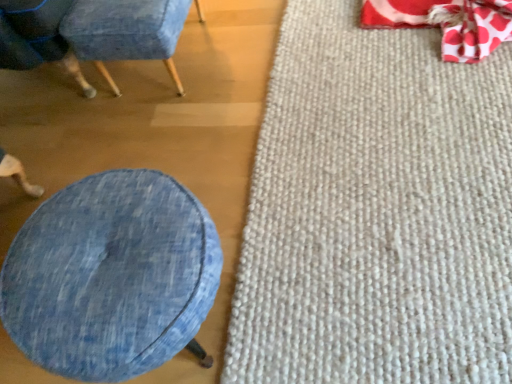
Question: Would you say denim fabric chair at upper left, which is the second chair from left to right, is outside red polka dot fabric bean bag chair at upper right?

Choices:
 (A) no
 (B) yes

Answer: (B)

Question: Considering the relative sizes of denim fabric chair at upper left, the first chair in the right-to-left sequence, and red polka dot fabric bean bag chair at upper right in the image provided, is denim fabric chair at upper left, the first chair in the right-to-left sequence, bigger than red polka dot fabric bean bag chair at upper right?

Choices:
 (A) no
 (B) yes

Answer: (B)

Question: From the image's perspective, does denim fabric chair at upper left, which is the second chair from left to right, appear lower than red polka dot fabric bean bag chair at upper right?

Choices:
 (A) yes
 (B) no

Answer: (B)

Question: Considering the relative sizes of denim fabric chair at upper left, the first chair in the right-to-left sequence, and red polka dot fabric bean bag chair at upper right in the image provided, is denim fabric chair at upper left, the first chair in the right-to-left sequence, shorter than red polka dot fabric bean bag chair at upper right?

Choices:
 (A) yes
 (B) no

Answer: (B)

Question: Could you tell me if denim fabric chair at upper left, the first chair in the right-to-left sequence, is turned towards red polka dot fabric bean bag chair at upper right?

Choices:
 (A) yes
 (B) no

Answer: (A)

Question: Considering the relative sizes of denim fabric chair at upper left, which is the second chair from left to right, and red polka dot fabric bean bag chair at upper right in the image provided, is denim fabric chair at upper left, which is the second chair from left to right, wider than red polka dot fabric bean bag chair at upper right?

Choices:
 (A) yes
 (B) no

Answer: (A)

Question: Is denim fabric at left, which is counted as the 1th chair, starting from the left, smaller than denim fabric ottoman at lower left?

Choices:
 (A) no
 (B) yes

Answer: (A)

Question: From a real-world perspective, is denim fabric at left, which is counted as the 1th chair, starting from the left, positioned over denim fabric ottoman at lower left based on gravity?

Choices:
 (A) yes
 (B) no

Answer: (A)

Question: Does denim fabric at left, which is counted as the 1th chair, starting from the left, have a lesser width compared to denim fabric ottoman at lower left?

Choices:
 (A) yes
 (B) no

Answer: (B)

Question: Considering the relative positions of denim fabric at left, which appears as the 2th chair when viewed from the right, and denim fabric ottoman at lower left in the image provided, is denim fabric at left, which appears as the 2th chair when viewed from the right, to the right of denim fabric ottoman at lower left from the viewer's perspective?

Choices:
 (A) no
 (B) yes

Answer: (A)

Question: Is denim fabric at left, which is counted as the 1th chair, starting from the left, not close to denim fabric ottoman at lower left?

Choices:
 (A) no
 (B) yes

Answer: (A)

Question: Is denim fabric at left, which is counted as the 1th chair, starting from the left, positioned behind denim fabric ottoman at lower left?

Choices:
 (A) no
 (B) yes

Answer: (B)

Question: Is denim fabric ottoman at lower left at the left side of white textured mat at right?

Choices:
 (A) yes
 (B) no

Answer: (A)